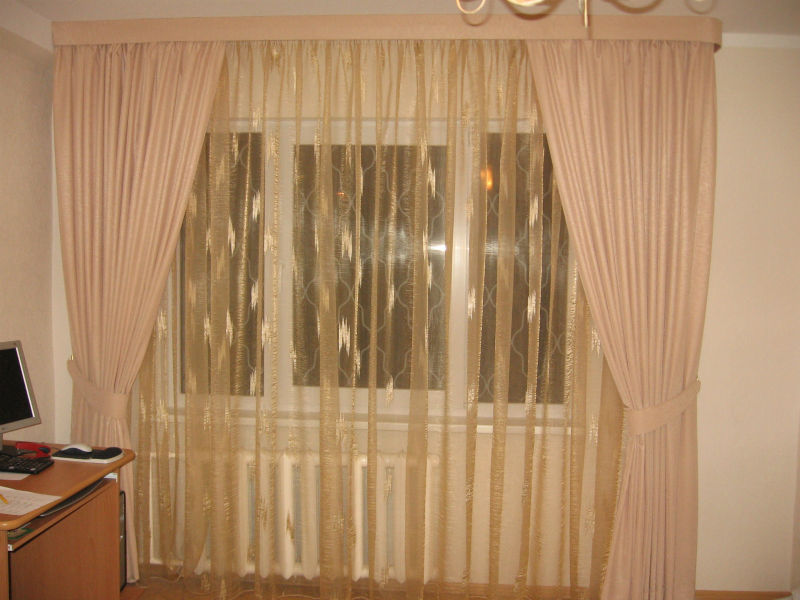
Where is `window frame`? The width and height of the screenshot is (800, 600). window frame is located at coordinates (270, 345), (454, 302).